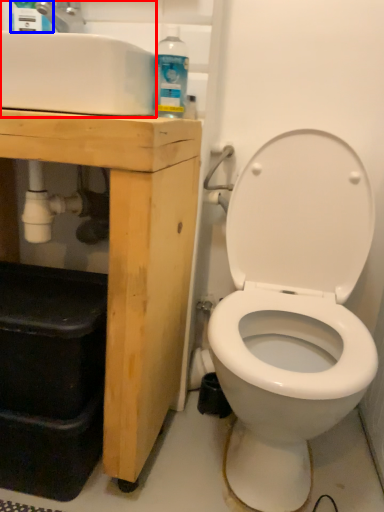
Question: Which object is further to the camera taking this photo, sink (highlighted by a red box) or cleaning product (highlighted by a blue box)?

Choices:
 (A) sink
 (B) cleaning product

Answer: (B)